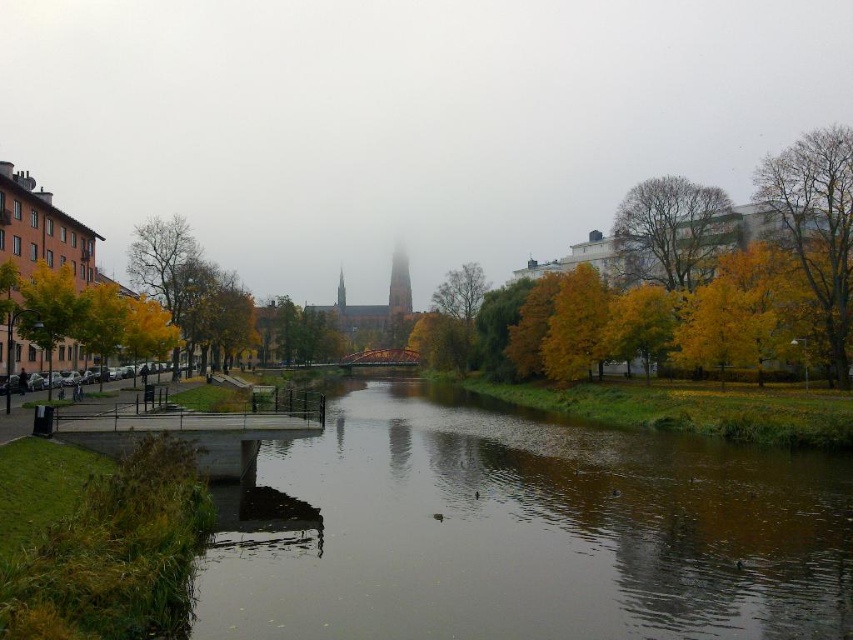
Is brown reflective water at center positioned in front of yellow leafy tree at right?

Yes, it is in front of yellow leafy tree at right.

Between brown reflective water at center and yellow leafy tree at right, which one appears on the right side from the viewer's perspective?

yellow leafy tree at right

Does point (421, 609) lie behind point (592, 344)?

That is False.

This screenshot has height=640, width=853. I want to click on brown reflective water at center, so click(x=523, y=531).

How much distance is there between yellow matte tree at center-right and yellow/golden leaves at center?

yellow matte tree at center-right and yellow/golden leaves at center are 4.18 meters apart from each other.

Where is `yellow matte tree at center-right`? yellow matte tree at center-right is located at coordinates (576, 324).

Is point (573, 346) positioned before point (662, 304)?

No, (573, 346) is behind (662, 304).

Locate an element on the screen. The width and height of the screenshot is (853, 640). yellow matte tree at center-right is located at coordinates (576, 324).

Which is more to the left, brown textured tree at right or yellow-green foliage at upper right?

yellow-green foliage at upper right is more to the left.

Describe the element at coordinates (817, 227) in the screenshot. The height and width of the screenshot is (640, 853). I see `brown textured tree at right` at that location.

Which is in front, point (836, 316) or point (659, 179)?

Positioned in front is point (836, 316).

What are the coordinates of `brown textured tree at right` in the screenshot? It's located at (817, 227).